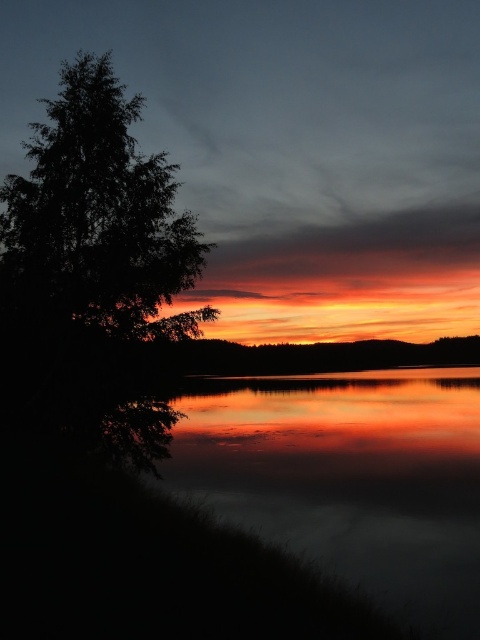
Consider the image. Which of these two, reflective glass water at lower left or dark green leafy tree at left, stands shorter?

reflective glass water at lower left

Is reflective glass water at lower left bigger than dark green leafy tree at left?

Correct, reflective glass water at lower left is larger in size than dark green leafy tree at left.

Is point (402, 550) positioned before point (35, 282)?

Yes, it is in front of point (35, 282).

Where is `reflective glass water at lower left`? The image size is (480, 640). reflective glass water at lower left is located at coordinates (347, 477).